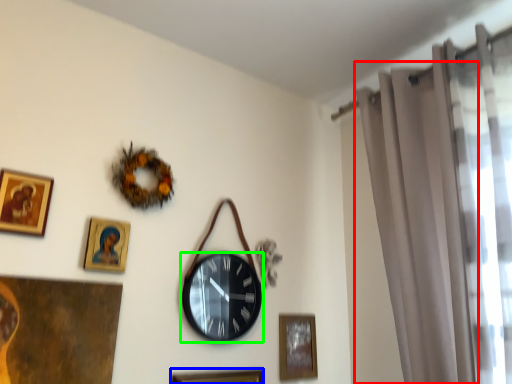
Question: Estimate the real-world distances between objects in this image. Which object is closer to curtain (highlighted by a red box), picture frame (highlighted by a blue box) or wall clock (highlighted by a green box)?

Choices:
 (A) picture frame
 (B) wall clock

Answer: (B)